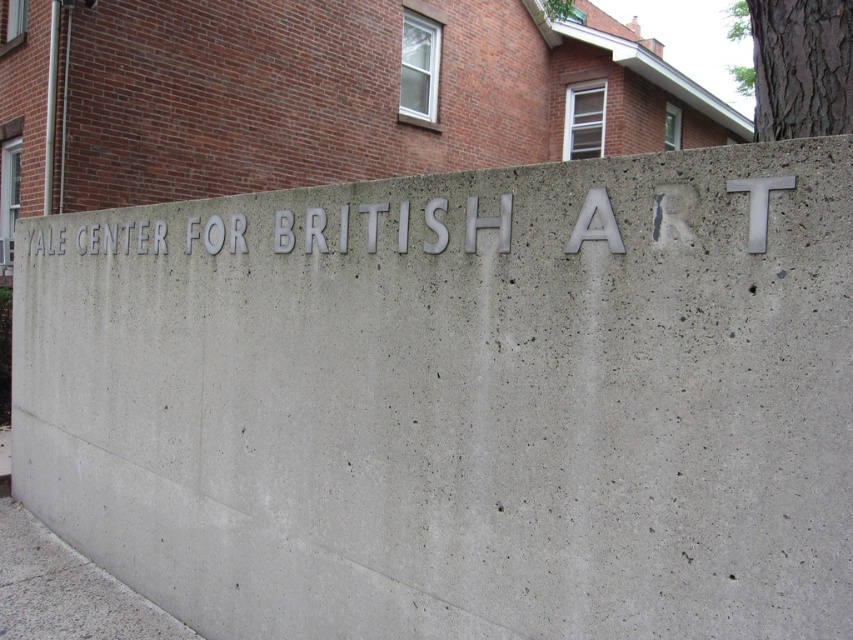
Question: Is the position of silver metallic letters at center more distant than that of brown textured bark at upper right?

Choices:
 (A) yes
 (B) no

Answer: (B)

Question: Among these objects, which one is nearest to the camera?

Choices:
 (A) brown textured bark at upper right
 (B) silver metallic letters at center

Answer: (B)

Question: Is silver metallic letters at center wider than brown textured bark at upper right?

Choices:
 (A) yes
 (B) no

Answer: (B)

Question: Does silver metallic letters at center lie in front of brown textured bark at upper right?

Choices:
 (A) yes
 (B) no

Answer: (A)

Question: Which point is closer to the camera?

Choices:
 (A) (612, 228)
 (B) (740, 35)

Answer: (A)